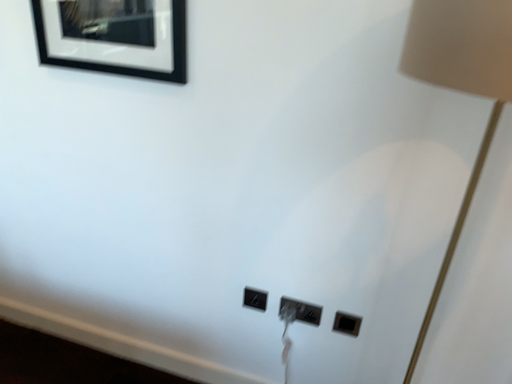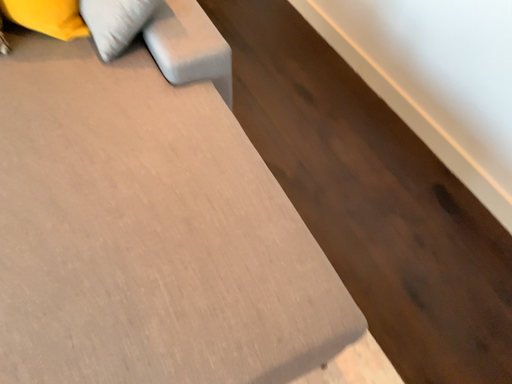
Question: How did the camera likely rotate when shooting the video?

Choices:
 (A) rotated right
 (B) rotated left

Answer: (B)